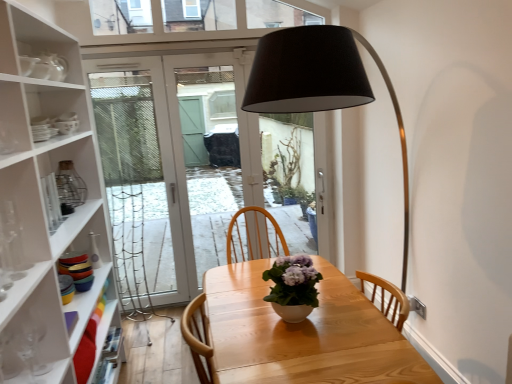
The image size is (512, 384). I want to click on empty space that is ontop of matte white door at center (from a real-world perspective), so click(x=173, y=44).